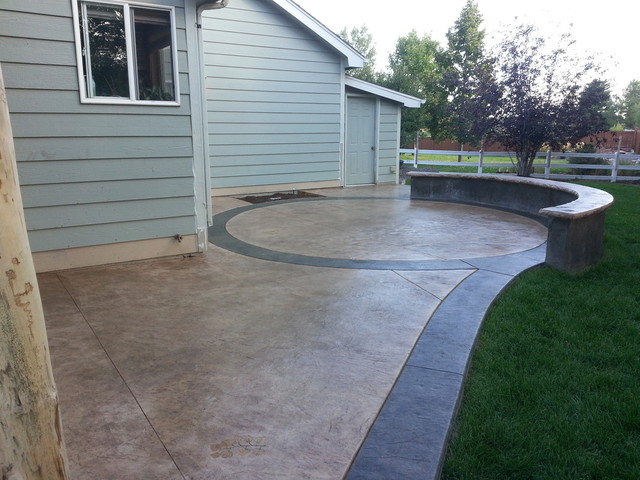
Image resolution: width=640 pixels, height=480 pixels. Find the location of `areas with a brown tile floor`. areas with a brown tile floor is located at coordinates (192, 351), (324, 223).